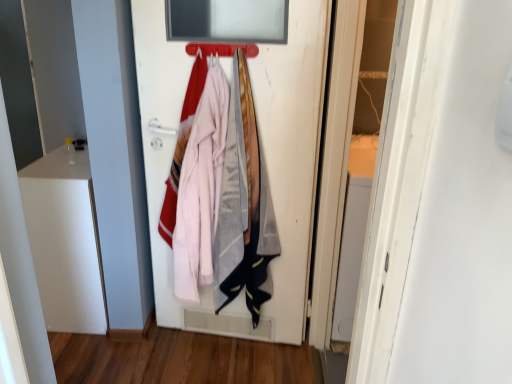
You are a GUI agent. You are given a task and a screenshot of the screen. Output one action in this format:
    pyautogui.click(x=<x>, y=<y>)
    Task: Click on the metallic silver hanger at upper center
    
    Given the screenshot: What is the action you would take?
    pyautogui.click(x=221, y=49)

The image size is (512, 384). Describe the element at coordinates (221, 49) in the screenshot. I see `metallic silver hanger at upper center` at that location.

The width and height of the screenshot is (512, 384). What do you see at coordinates (262, 162) in the screenshot?
I see `white matte door at center` at bounding box center [262, 162].

Locate an element on the screen. white matte door at center is located at coordinates (262, 162).

I want to click on metallic silver hanger at upper center, so click(221, 49).

Can you confirm if metallic silver hanger at upper center is positioned to the left of white matte door at center?

Indeed, metallic silver hanger at upper center is positioned on the left side of white matte door at center.

Does metallic silver hanger at upper center lie in front of white matte door at center?

No, metallic silver hanger at upper center is further to the viewer.

Considering the positions of points (227, 50) and (304, 276), is point (227, 50) closer to camera compared to point (304, 276)?

Yes, point (227, 50) is closer to viewer.

From the image's perspective, is metallic silver hanger at upper center positioned above or below white matte door at center?

Clearly, from the image's perspective, metallic silver hanger at upper center is above white matte door at center.

From a real-world perspective, which is physically below, metallic silver hanger at upper center or white matte door at center?

white matte door at center is physically lower.

Is metallic silver hanger at upper center wider than white matte door at center?

Yes, metallic silver hanger at upper center is wider than white matte door at center.

Considering the sizes of objects metallic silver hanger at upper center and white matte door at center in the image provided, who is taller, metallic silver hanger at upper center or white matte door at center?

white matte door at center.

Considering the relative sizes of metallic silver hanger at upper center and white matte door at center in the image provided, is metallic silver hanger at upper center smaller than white matte door at center?

Correct, metallic silver hanger at upper center occupies less space than white matte door at center.

Is metallic silver hanger at upper center inside the boundaries of white matte door at center, or outside?

The correct answer is: outside.

Is metallic silver hanger at upper center directly adjacent to white matte door at center?

No, metallic silver hanger at upper center is not in contact with white matte door at center.

Could you tell me if metallic silver hanger at upper center is turned towards white matte door at center?

No, metallic silver hanger at upper center is not aimed at white matte door at center.

How different are the orientations of metallic silver hanger at upper center and white matte door at center in degrees?

The facing directions of metallic silver hanger at upper center and white matte door at center are 1.93 degrees apart.

The height and width of the screenshot is (384, 512). I want to click on hanger behind the white matte door at center, so click(x=221, y=49).

From the picture: Which is more to the left, white matte door at center or metallic silver hanger at upper center?

Positioned to the left is metallic silver hanger at upper center.

Is white matte door at center in front of or behind metallic silver hanger at upper center in the image?

white matte door at center is in front of metallic silver hanger at upper center.

Between point (259, 87) and point (208, 45), which one is positioned in front?

Positioned in front is point (208, 45).

From the image's perspective, is white matte door at center over metallic silver hanger at upper center?

No, from the image's perspective, white matte door at center is not over metallic silver hanger at upper center.

From a real-world perspective, is white matte door at center physically below metallic silver hanger at upper center?

Correct, in the physical world, white matte door at center is lower than metallic silver hanger at upper center.

Considering the relative sizes of white matte door at center and metallic silver hanger at upper center in the image provided, is white matte door at center thinner than metallic silver hanger at upper center?

Yes, white matte door at center is thinner than metallic silver hanger at upper center.

Is white matte door at center taller or shorter than metallic silver hanger at upper center?

Considering their sizes, white matte door at center has more height than metallic silver hanger at upper center.

Considering the sizes of white matte door at center and metallic silver hanger at upper center in the image, is white matte door at center bigger or smaller than metallic silver hanger at upper center?

In the image, white matte door at center appears to be larger than metallic silver hanger at upper center.

Is white matte door at center completely or partially outside of metallic silver hanger at upper center?

Yes, white matte door at center is located beyond the bounds of metallic silver hanger at upper center.

Consider the image. Is white matte door at center positioned far away from metallic silver hanger at upper center?

That's not correct — white matte door at center is a little close to metallic silver hanger at upper center.

Is white matte door at center aimed at metallic silver hanger at upper center?

Yes, white matte door at center is aimed at metallic silver hanger at upper center.

What's the angular difference between white matte door at center and metallic silver hanger at upper center's facing directions?

There is a 1.93-degree angle between the facing directions of white matte door at center and metallic silver hanger at upper center.

The width and height of the screenshot is (512, 384). Identify the location of hanger on the left of white matte door at center. (221, 49).

The image size is (512, 384). What are the coordinates of `door below the metallic silver hanger at upper center (from the image's perspective)` in the screenshot? It's located at (262, 162).

Identify the location of hanger lying behind the white matte door at center. The width and height of the screenshot is (512, 384). (221, 49).